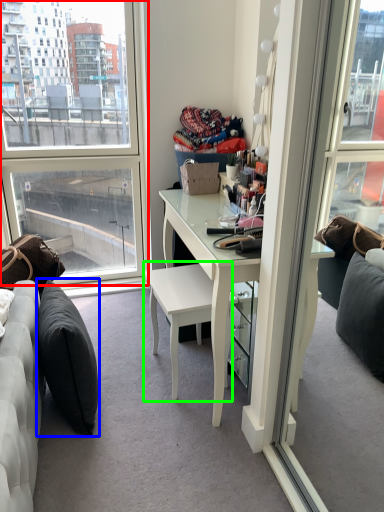
Question: Estimate the real-world distances between objects in this image. Which object is closer to window (highlighted by a red box), pillow (highlighted by a blue box) or chair (highlighted by a green box)?

Choices:
 (A) pillow
 (B) chair

Answer: (A)